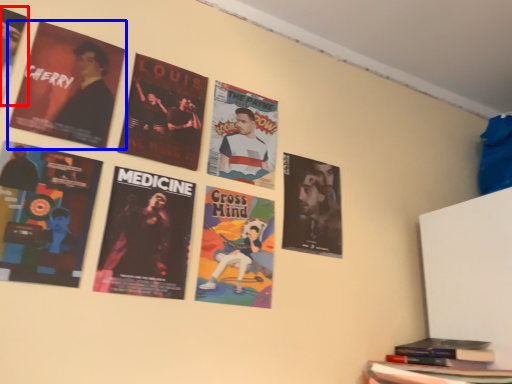
Question: Which object appears farthest to the camera in this image, poster (highlighted by a red box) or poster (highlighted by a blue box)?

Choices:
 (A) poster
 (B) poster

Answer: (B)